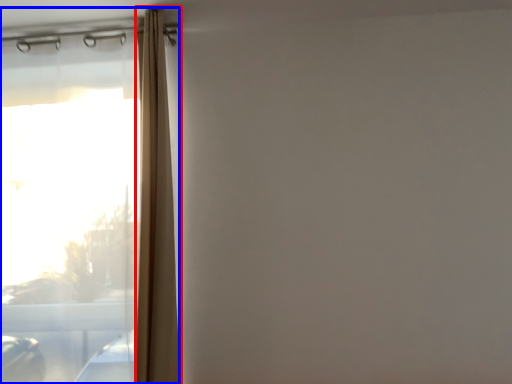
Question: Which of the following is the farthest to the observer, shower curtain (highlighted by a red box) or window (highlighted by a blue box)?

Choices:
 (A) shower curtain
 (B) window

Answer: (B)